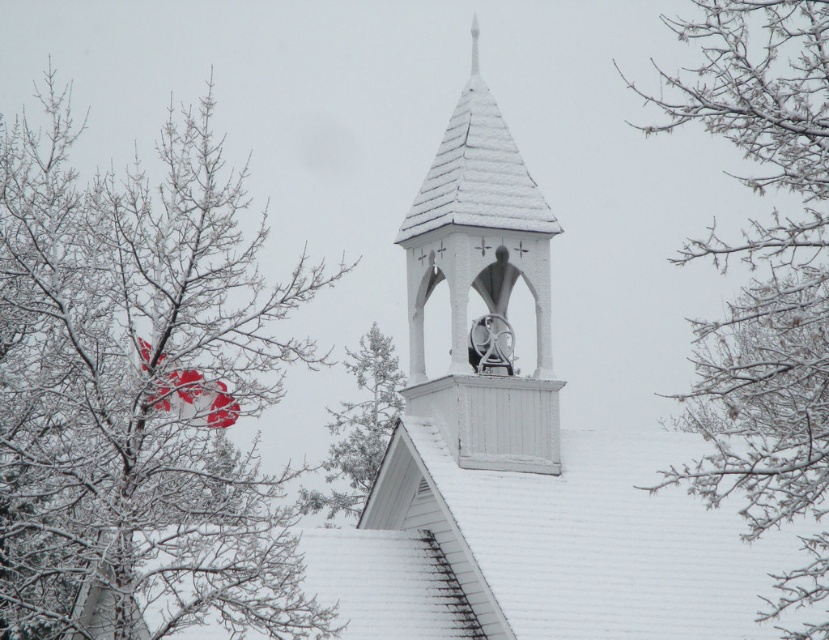
You are standing in front of the winter scene with the church steeple. You notice two points marked in the image. Which point, point (797, 582) or point (328, 465), is closer to you?

Point (797, 582) is closer to the viewer than point (328, 465).